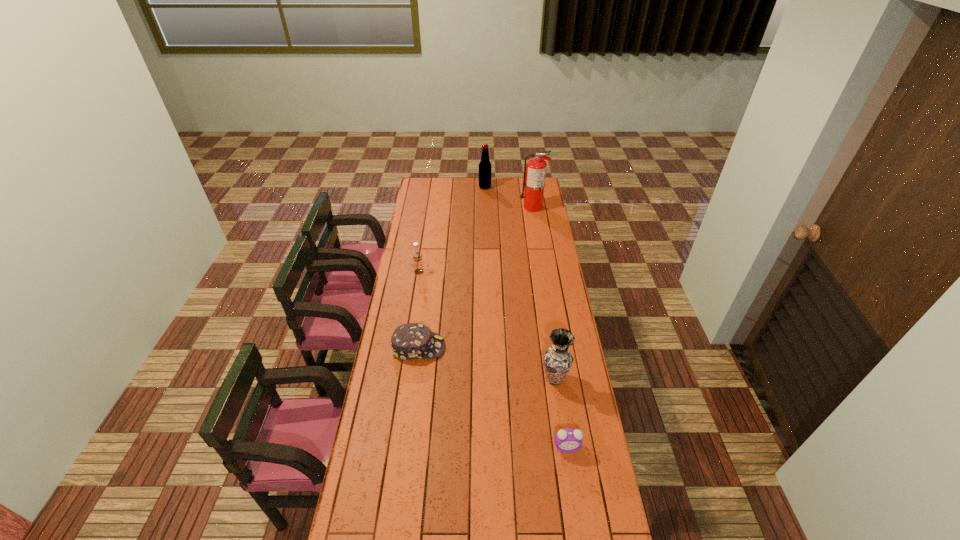
Find the location of a particular element. The image size is (960, 540). fire extinguisher located at the right edge is located at coordinates (535, 170).

Locate an element on the screen. Image resolution: width=960 pixels, height=540 pixels. vase present at the right edge is located at coordinates (557, 360).

Identify the location of alarm clock located in the right edge section of the desktop. The width and height of the screenshot is (960, 540). (567, 440).

This screenshot has width=960, height=540. In order to click on vacant point at the far edge in this screenshot , I will do `click(487, 190)`.

The width and height of the screenshot is (960, 540). I want to click on free space at the left edge of the desktop, so click(358, 537).

Image resolution: width=960 pixels, height=540 pixels. I want to click on blank space at the right edge of the desktop, so click(540, 256).

This screenshot has width=960, height=540. I want to click on vacant space in between the farthest object and the tallest object, so click(509, 197).

Locate an element on the screen. The width and height of the screenshot is (960, 540). free space between the tallest object and the vodka is located at coordinates (476, 239).

This screenshot has height=540, width=960. I want to click on empty space between the vodka and the farthest object, so click(452, 230).

In order to click on free space between the third farthest object and the fifth farthest object in this screenshot , I will do 487,326.